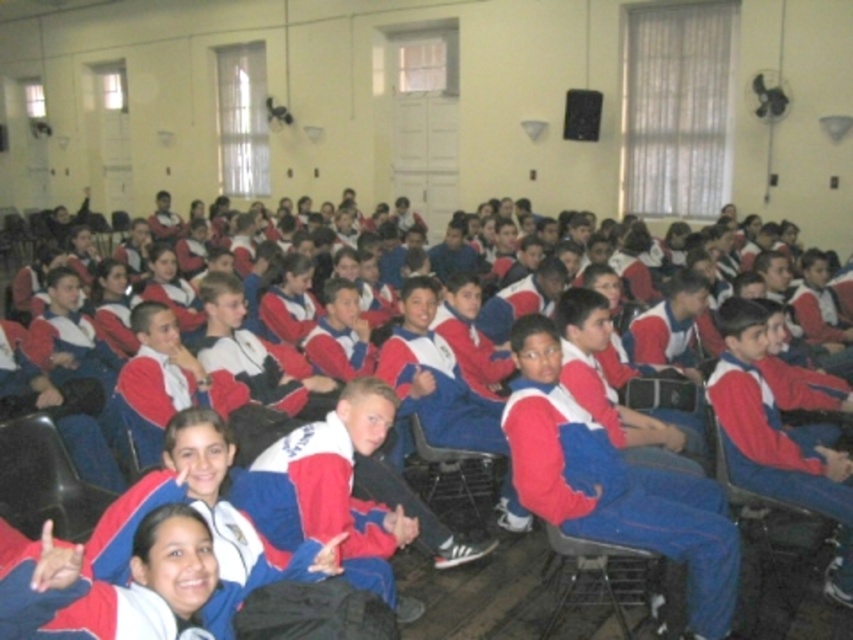
Is matte blue jumpsuit at center to the right of metallic gray chair at lower center from the viewer's perspective?

Yes, matte blue jumpsuit at center is to the right of metallic gray chair at lower center.

Between matte blue jumpsuit at center and metallic gray chair at lower center, which one has less height?

With less height is metallic gray chair at lower center.

Is point (698, 516) positioned before point (646, 560)?

Yes, point (698, 516) is closer to viewer.

The image size is (853, 640). I want to click on matte blue jumpsuit at center, so click(619, 497).

Does point (621, 621) come in front of point (447, 460)?

Yes.

Does point (548, 573) lie behind point (415, 440)?

No.

You are a GUI agent. You are given a task and a screenshot of the screen. Output one action in this format:
    pyautogui.click(x=<x>, y=<y>)
    Task: Click on the metallic gray chair at lower center
    The width and height of the screenshot is (853, 640).
    Given the screenshot: What is the action you would take?
    pyautogui.click(x=599, y=577)

Does point (614, 502) come closer to viewer compared to point (457, 484)?

Yes, it is.

Is point (602, 468) positioned in front of point (445, 467)?

Yes, point (602, 468) is closer to viewer.

The image size is (853, 640). I want to click on matte blue jumpsuit at center, so click(619, 497).